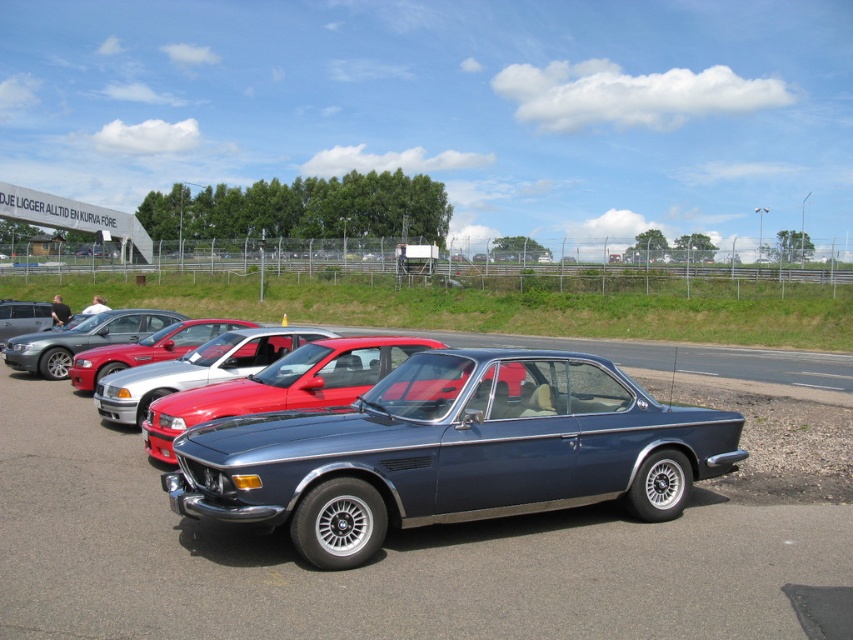
Can you confirm if glossy metallic car at center is positioned above silver metallic sedan at center?

Actually, glossy metallic car at center is below silver metallic sedan at center.

Can you confirm if glossy metallic car at center is positioned to the left of silver metallic sedan at center?

No, glossy metallic car at center is not to the left of silver metallic sedan at center.

Who is more distant from viewer, [599,376] or [173,320]?

The point [173,320] is more distant.

You are a GUI agent. You are given a task and a screenshot of the screen. Output one action in this format:
    pyautogui.click(x=<x>, y=<y>)
    Task: Click on the glossy metallic car at center
    The width and height of the screenshot is (853, 640).
    Given the screenshot: What is the action you would take?
    pyautogui.click(x=451, y=451)

Based on the photo, is glossy metallic car at center below satin blue car at center?

Yes.

Is point (689, 451) less distant than point (339, 358)?

That is True.

This screenshot has height=640, width=853. Find the location of `glossy metallic car at center`. glossy metallic car at center is located at coordinates (451, 451).

Is metallic blue car at center taller than satin blue car at center?

Incorrect, metallic blue car at center's height is not larger of satin blue car at center's.

Is metallic blue car at center positioned at the back of satin blue car at center?

No, metallic blue car at center is in front of satin blue car at center.

Between point (393, 545) and point (364, 388), which one is positioned behind?

Point (364, 388)

Image resolution: width=853 pixels, height=640 pixels. Identify the location of metallic blue car at center. (424, 547).